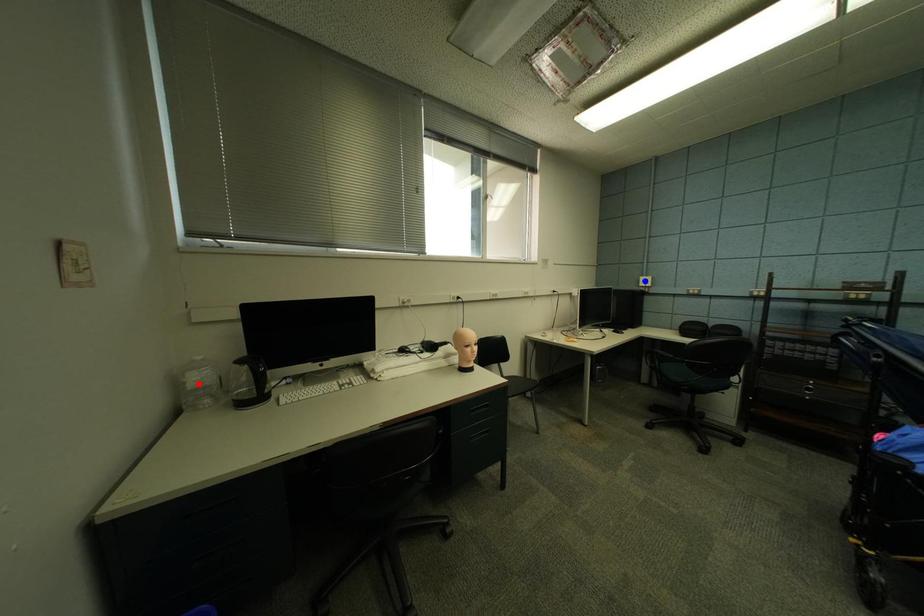
Question: Which of the two points in the image is closer to the camera?

Choices:
 (A) Blue point is closer.
 (B) Red point is closer.

Answer: (B)